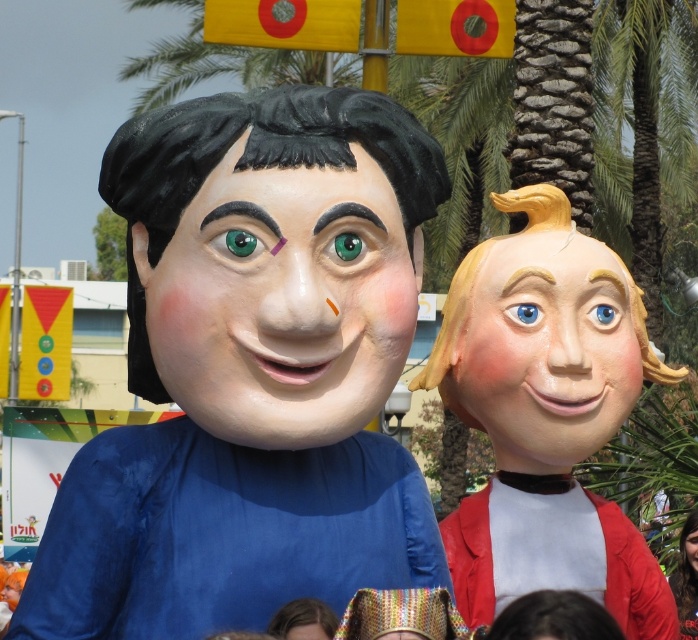
Is point (460, 400) farther from viewer compared to point (695, 545)?

No, it is in front of (695, 545).

Can you confirm if smooth beige face at right is positioned below smooth skin face at center?

No, smooth beige face at right is not below smooth skin face at center.

Which is behind, point (572, 336) or point (685, 557)?

Point (685, 557)

Locate an element on the screen. The width and height of the screenshot is (698, 640). smooth beige face at right is located at coordinates (547, 352).

Based on the photo, between matte blue costume at center and smooth yellow hair at right, which one appears on the right side from the viewer's perspective?

Positioned to the right is smooth yellow hair at right.

Is matte blue costume at center further to camera compared to smooth yellow hair at right?

No, it is not.

Is point (385, 116) farther from camera compared to point (493, 432)?

No.

Identify the location of matte blue costume at center. This screenshot has width=698, height=640. (251, 371).

Between matte plastic face at center and smooth beige face at right, which one appears on the right side from the viewer's perspective?

smooth beige face at right is more to the right.

Locate an element on the screen. The width and height of the screenshot is (698, 640). matte plastic face at center is located at coordinates (282, 300).